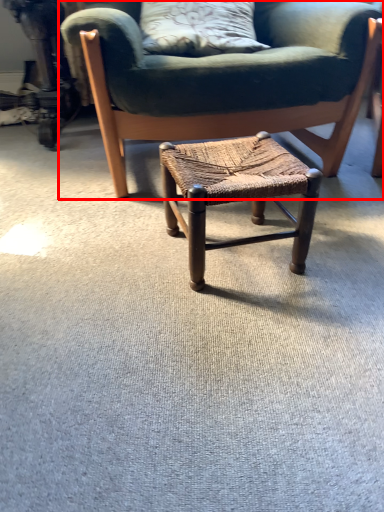
Question: From the image's perspective, considering the relative positions of chair (annotated by the red box) and stool in the image provided, where is chair (annotated by the red box) located with respect to the staircase?

Choices:
 (A) below
 (B) above

Answer: (B)